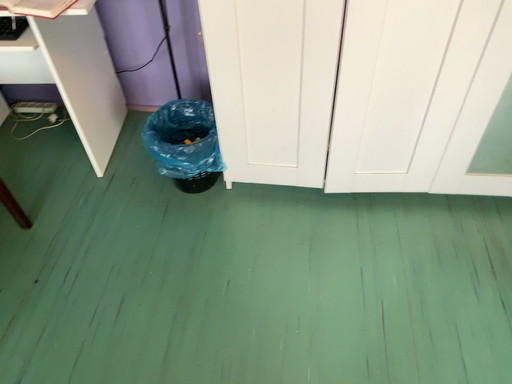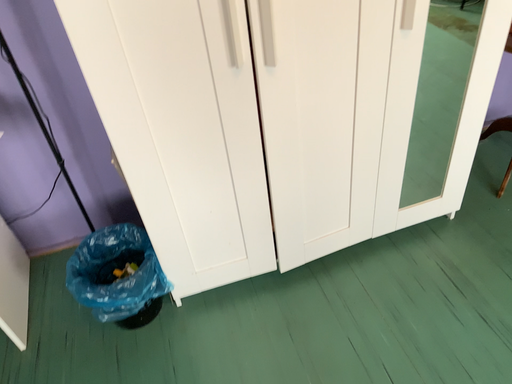
Question: Which way did the camera rotate in the video?

Choices:
 (A) rotated left
 (B) rotated right

Answer: (B)